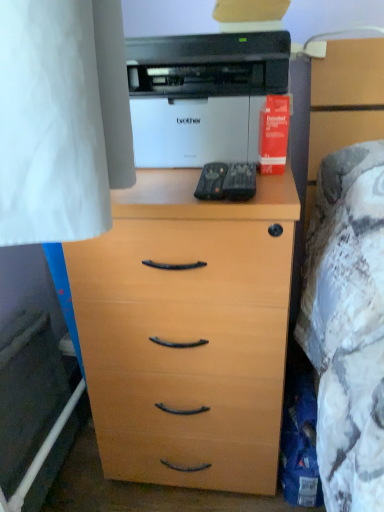
Describe the element at coordinates (187, 331) in the screenshot. The image size is (384, 512). I see `light wood chest of drawers at center` at that location.

What is the approximate width of red matte paper at upper right?

1.98 inches.

Image resolution: width=384 pixels, height=512 pixels. What do you see at coordinates (273, 134) in the screenshot?
I see `red matte paper at upper right` at bounding box center [273, 134].

Describe the element at coordinates (202, 95) in the screenshot. The height and width of the screenshot is (512, 384). I see `white glossy printer at upper center` at that location.

Find the location of `light wood chest of drawers at center`. light wood chest of drawers at center is located at coordinates (187, 331).

Which object is thinner, red matte paper at upper right or light wood chest of drawers at center?

With smaller width is red matte paper at upper right.

In the scene shown: Considering their positions, is red matte paper at upper right located in front of or behind light wood chest of drawers at center?

Clearly, red matte paper at upper right is behind light wood chest of drawers at center.

What's the angular difference between red matte paper at upper right and light wood chest of drawers at center's facing directions?

The angular difference between red matte paper at upper right and light wood chest of drawers at center is 0.00132 degrees.

Identify the location of the chest of drawers that appears below the red matte paper at upper right (from the image's perspective). (187, 331).

Considering the relative sizes of white glossy printer at upper center and light wood chest of drawers at center in the image provided, is white glossy printer at upper center bigger than light wood chest of drawers at center?

Actually, white glossy printer at upper center might be smaller than light wood chest of drawers at center.

From the image's perspective, between white glossy printer at upper center and light wood chest of drawers at center, who is located below?

light wood chest of drawers at center is shown below in the image.

From a real-world perspective, is white glossy printer at upper center over light wood chest of drawers at center?

Yes, from a real-world perspective, white glossy printer at upper center is over light wood chest of drawers at center

Relative to white glossy printer at upper center, is light wood chest of drawers at center in front or behind?

Clearly, light wood chest of drawers at center is in front of white glossy printer at upper center.

Considering the sizes of objects light wood chest of drawers at center and white glossy printer at upper center in the image provided, who is bigger, light wood chest of drawers at center or white glossy printer at upper center?

light wood chest of drawers at center is bigger.

Is white glossy printer at upper center far from red matte paper at upper right?

white glossy printer at upper center is actually quite close to red matte paper at upper right.

From a real-world perspective, which is physically above, white glossy printer at upper center or red matte paper at upper right?

white glossy printer at upper center, from a real-world perspective.

Considering the relative sizes of white glossy printer at upper center and red matte paper at upper right in the image provided, is white glossy printer at upper center taller than red matte paper at upper right?

Indeed, white glossy printer at upper center has a greater height compared to red matte paper at upper right.

Consider the image. Is white glossy printer at upper center not within red matte paper at upper right?

Yes, white glossy printer at upper center is outside of red matte paper at upper right.

Consider the image. Is the depth of red matte paper at upper right greater than that of white glossy printer at upper center?

Yes, red matte paper at upper right is further from the camera.

Considering the sizes of red matte paper at upper right and white glossy printer at upper center in the image, is red matte paper at upper right wider or thinner than white glossy printer at upper center?

red matte paper at upper right is thinner than white glossy printer at upper center.

Between light wood chest of drawers at center and red matte paper at upper right, which one appears on the left side from the viewer's perspective?

light wood chest of drawers at center.

Is light wood chest of drawers at center facing away from red matte paper at upper right?

No, light wood chest of drawers at center's orientation is not away from red matte paper at upper right.

How distant is light wood chest of drawers at center from red matte paper at upper right?

light wood chest of drawers at center is 39.58 centimeters from red matte paper at upper right.

From a real-world perspective, which is physically below, light wood chest of drawers at center or red matte paper at upper right?

light wood chest of drawers at center.

Where is `book lying above the light wood chest of drawers at center (from the image's perspective)`? The height and width of the screenshot is (512, 384). book lying above the light wood chest of drawers at center (from the image's perspective) is located at coordinates (273, 134).

Where is `printer on the right of light wood chest of drawers at center`? The image size is (384, 512). printer on the right of light wood chest of drawers at center is located at coordinates (202, 95).

Considering their positions, is light wood chest of drawers at center positioned further to red matte paper at upper right than white glossy printer at upper center?

The object further to red matte paper at upper right is light wood chest of drawers at center.

Estimate the real-world distances between objects in this image. Which object is further from red matte paper at upper right, white glossy printer at upper center or light wood chest of drawers at center?

Based on the image, light wood chest of drawers at center appears to be further to red matte paper at upper right.

Estimate the real-world distances between objects in this image. Which object is further from white glossy printer at upper center, red matte paper at upper right or light wood chest of drawers at center?

light wood chest of drawers at center lies further to white glossy printer at upper center than the other object.

Based on their spatial positions, is red matte paper at upper right or white glossy printer at upper center closer to light wood chest of drawers at center?

white glossy printer at upper center.

Considering their positions, is light wood chest of drawers at center positioned closer to white glossy printer at upper center than red matte paper at upper right?

red matte paper at upper right is closer to white glossy printer at upper center.

When comparing their distances from light wood chest of drawers at center, does white glossy printer at upper center or red matte paper at upper right seem closer?

white glossy printer at upper center is positioned closer to the anchor light wood chest of drawers at center.

Identify the location of book between white glossy printer at upper center and light wood chest of drawers at center in the up-down direction. (273, 134).